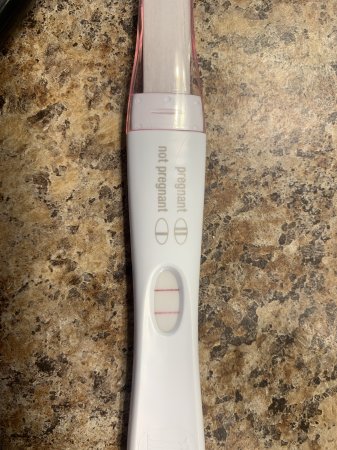
I want to click on results positive showing window, so click(x=175, y=288).